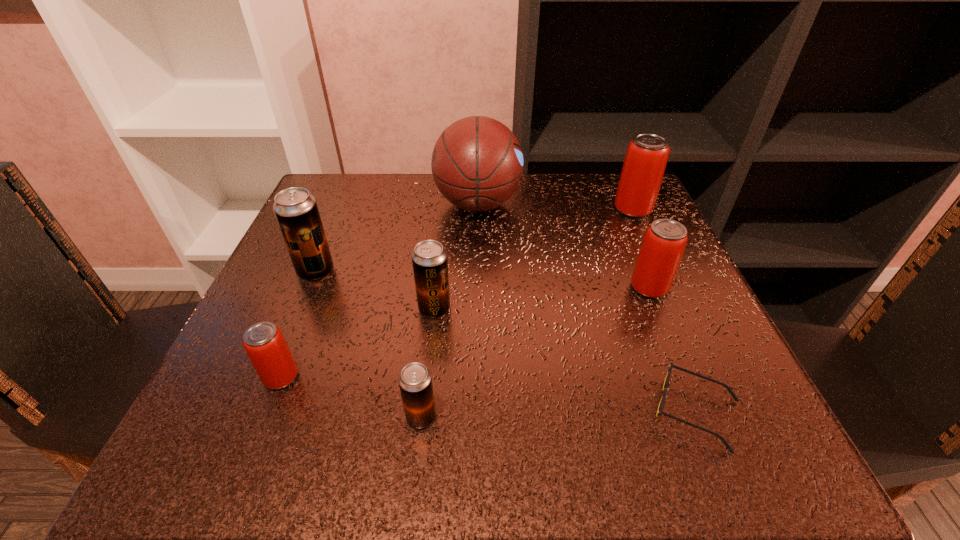
You are a GUI agent. You are given a task and a screenshot of the screen. Output one action in this format:
    pyautogui.click(x=<x>, y=<y>)
    Task: Click on the pink beer can that is the closest one to the farthest black beer can
    
    Given the screenshot: What is the action you would take?
    pyautogui.click(x=264, y=343)

Identify the location of the closest black beer can relative to the biggest pink beer can. (429, 259).

Identify which black beer can is located as the nearest to the nearest black beer can. Please provide its 2D coordinates. Your answer should be formatted as a tuple, i.e. [(x, y)], where the tuple contains the x and y coordinates of a point satisfying the conditions above.

[(429, 259)]